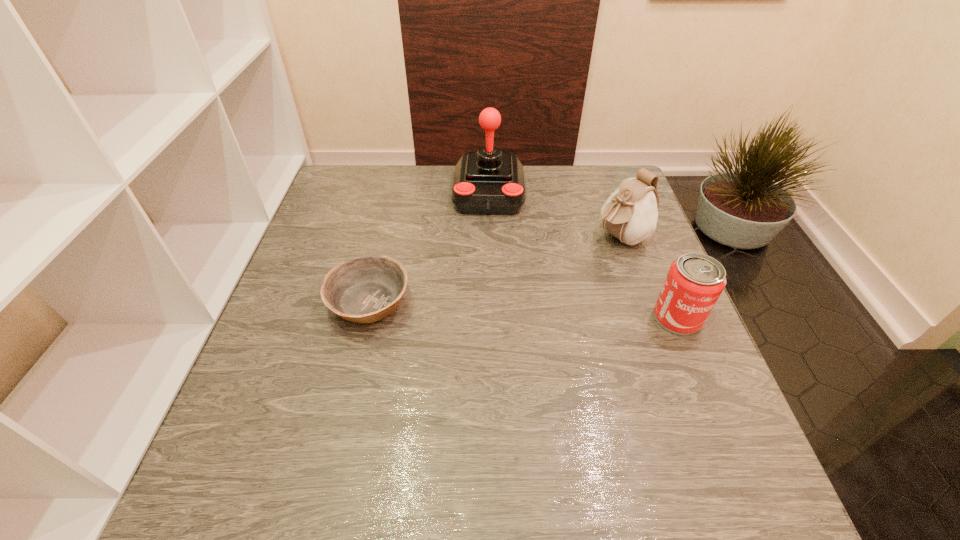
This screenshot has height=540, width=960. In order to click on vacant position located on the front-facing side of the third shortest object in this screenshot , I will do `click(550, 276)`.

You are a GUI agent. You are given a task and a screenshot of the screen. Output one action in this format:
    pyautogui.click(x=<x>, y=<y>)
    Task: Click on the blank space located 0.160m on the base of the joystick
    This screenshot has width=960, height=540.
    Given the screenshot: What is the action you would take?
    pyautogui.click(x=487, y=264)

Where is `free region located 0.300m on the base of the joystick`? The height and width of the screenshot is (540, 960). free region located 0.300m on the base of the joystick is located at coordinates (485, 307).

This screenshot has width=960, height=540. In order to click on blank space located 0.220m on the base of the joystick in this screenshot , I will do `click(486, 282)`.

At what (x,y) coordinates should I click in order to perform the action: click on object at the far edge. Please return your answer as a coordinate pair (x, y). Looking at the image, I should click on (486, 182).

I want to click on object at the left edge, so click(x=366, y=289).

The height and width of the screenshot is (540, 960). Identify the location of can that is at the right edge. (695, 281).

The height and width of the screenshot is (540, 960). Identify the location of pouch situated at the right edge. (630, 214).

The width and height of the screenshot is (960, 540). In order to click on vacant area at the far edge of the desktop in this screenshot , I will do `click(396, 168)`.

Find the location of a particular element. This screenshot has width=960, height=540. vacant area at the left edge is located at coordinates (328, 343).